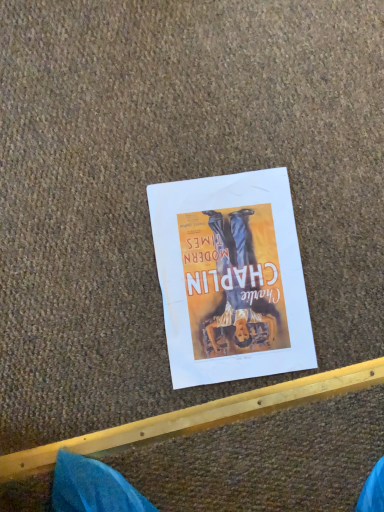
In order to click on white paper poster at center in this screenshot , I will do `click(231, 278)`.

Describe the element at coordinates (231, 278) in the screenshot. This screenshot has width=384, height=512. I see `white paper poster at center` at that location.

This screenshot has height=512, width=384. Find the location of `white paper poster at center`. white paper poster at center is located at coordinates (231, 278).